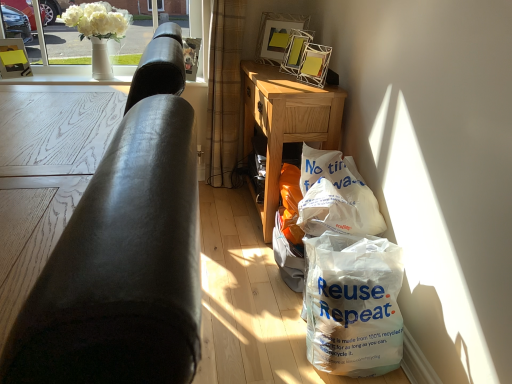
Question: From a real-world perspective, is white plastic bag at lower right on white ceramic vase at upper left, arranged as the 2th window screen when viewed from the left?

Choices:
 (A) yes
 (B) no

Answer: (B)

Question: Can you confirm if white plastic bag at lower right is wider than white ceramic vase at upper left, arranged as the 2th window screen when viewed from the left?

Choices:
 (A) no
 (B) yes

Answer: (B)

Question: Could you tell me if white plastic bag at lower right is turned towards white ceramic vase at upper left, the 1th window screen positioned from the right?

Choices:
 (A) no
 (B) yes

Answer: (A)

Question: Considering the relative sizes of white plastic bag at lower right and white ceramic vase at upper left, arranged as the 2th window screen when viewed from the left, in the image provided, is white plastic bag at lower right thinner than white ceramic vase at upper left, arranged as the 2th window screen when viewed from the left,?

Choices:
 (A) yes
 (B) no

Answer: (B)

Question: Are white plastic bag at lower right and white ceramic vase at upper left, arranged as the 2th window screen when viewed from the left, far apart?

Choices:
 (A) no
 (B) yes

Answer: (B)

Question: Is black leather couch at left spatially inside white glass vase at upper center, the 1th window screen from the left, or outside of it?

Choices:
 (A) outside
 (B) inside

Answer: (A)

Question: From the image's perspective, relative to white glass vase at upper center, the 1th window screen from the left, is black leather couch at left above or below?

Choices:
 (A) below
 (B) above

Answer: (A)

Question: From a real-world perspective, is black leather couch at left above or below white glass vase at upper center, positioned as the 2th window screen in right-to-left order?

Choices:
 (A) above
 (B) below

Answer: (B)

Question: In the image, is black leather couch at left on the left side or the right side of white glass vase at upper center, positioned as the 2th window screen in right-to-left order?

Choices:
 (A) right
 (B) left

Answer: (A)

Question: Considering the positions of metallic silver picture frame at upper center, arranged as the first picture frame when viewed from the right, and white glass vase at upper center, positioned as the 2th window screen in right-to-left order, in the image, is metallic silver picture frame at upper center, arranged as the first picture frame when viewed from the right, wider or thinner than white glass vase at upper center, positioned as the 2th window screen in right-to-left order,?

Choices:
 (A) thin
 (B) wide

Answer: (B)

Question: From a real-world perspective, is metallic silver picture frame at upper center, arranged as the first picture frame when viewed from the right, physically located above or below white glass vase at upper center, the 1th window screen from the left?

Choices:
 (A) above
 (B) below

Answer: (A)

Question: From the image's perspective, is metallic silver picture frame at upper center, which is the third picture frame in left-to-right order, located above or below white glass vase at upper center, the 1th window screen from the left?

Choices:
 (A) below
 (B) above

Answer: (A)

Question: Would you say metallic silver picture frame at upper center, arranged as the first picture frame when viewed from the right, is to the left or to the right of white glass vase at upper center, the 1th window screen from the left, in the picture?

Choices:
 (A) left
 (B) right

Answer: (B)

Question: In terms of width, does plaid fabric curtain at center look wider or thinner when compared to white paper bag at lower right?

Choices:
 (A) thin
 (B) wide

Answer: (A)

Question: Is plaid fabric curtain at center spatially inside white paper bag at lower right, or outside of it?

Choices:
 (A) inside
 (B) outside

Answer: (B)